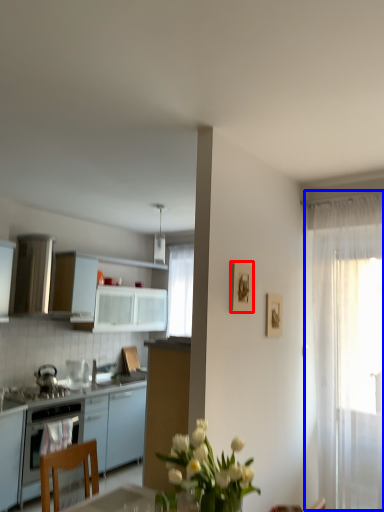
Question: Which of the following is the farthest to the observer, picture frame (highlighted by a red box) or curtain (highlighted by a blue box)?

Choices:
 (A) picture frame
 (B) curtain

Answer: (B)